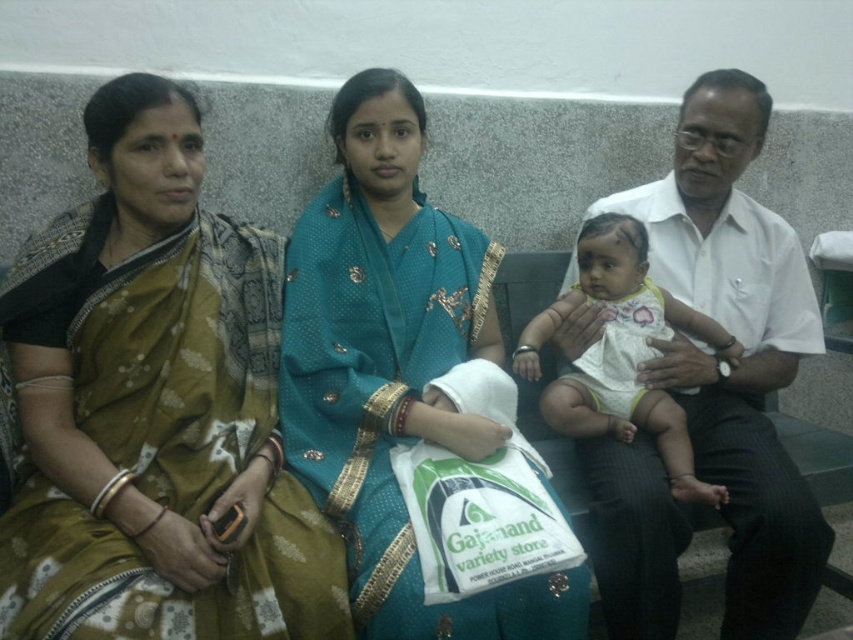
You are a photographer planning to take a group photo of the teal silk saree at center and the white cotton baby at center. Which one should you focus on first if you want to ensure both are in focus?

The teal silk saree at center is taller than the white cotton baby at center, so you should focus on the taller object first to ensure depth of field covers both.